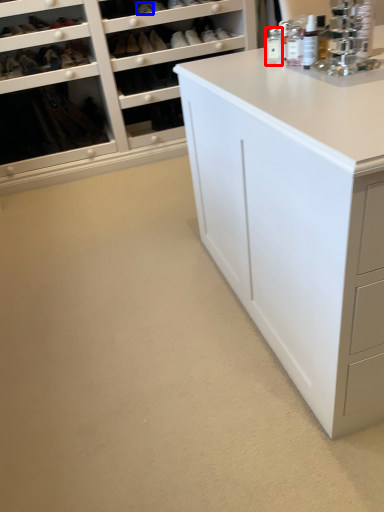
Question: Which object is closer to the camera taking this photo, toiletry (highlighted by a red box) or shoe (highlighted by a blue box)?

Choices:
 (A) toiletry
 (B) shoe

Answer: (A)